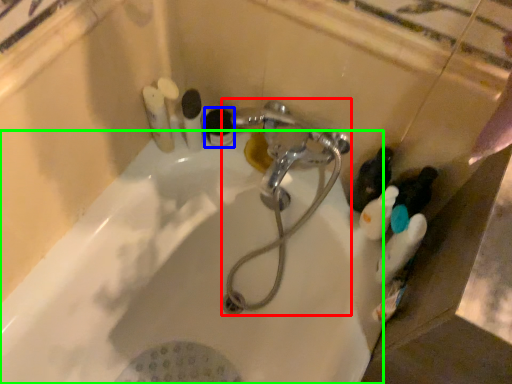
Question: Which object is the closest to the plumbing fixture (highlighted by a red box)? Choose among these: toiletry (highlighted by a blue box) or bath (highlighted by a green box).

Choices:
 (A) toiletry
 (B) bath

Answer: (B)